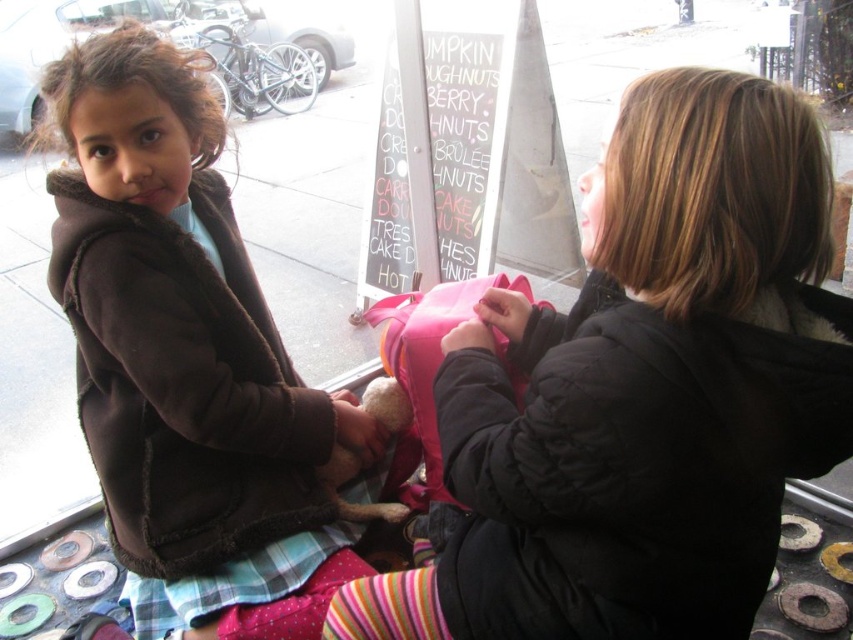
Can you confirm if brown fuzzy jacket at left is wider than striped cotton sock at lower center?

Correct, the width of brown fuzzy jacket at left exceeds that of striped cotton sock at lower center.

Does brown fuzzy jacket at left have a smaller size compared to striped cotton sock at lower center?

No.

Is point (113, 108) less distant than point (427, 577)?

No, it is not.

Image resolution: width=853 pixels, height=640 pixels. I want to click on brown fuzzy jacket at left, so coord(187,358).

Does matte pink backpack at center appear under striped cotton sock at lower center?

No.

Measure the distance between point (606, 410) and camera.

Point (606, 410) is 30.12 inches from camera.

Find the location of a particular element. This screenshot has width=853, height=640. matte pink backpack at center is located at coordinates (654, 381).

Is matte pink backpack at center smaller than brown fuzzy jacket at left?

Indeed, matte pink backpack at center has a smaller size compared to brown fuzzy jacket at left.

Between matte pink backpack at center and brown fuzzy jacket at left, which one appears on the right side from the viewer's perspective?

Positioned to the right is matte pink backpack at center.

Identify the location of matte pink backpack at center. (654, 381).